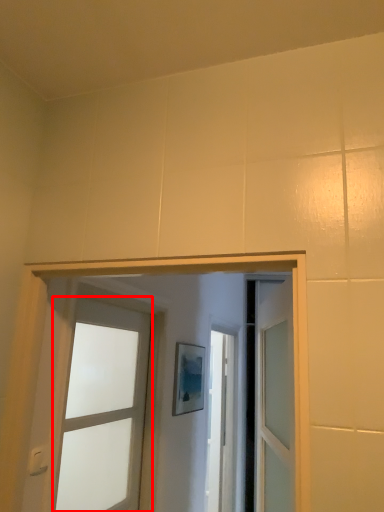
Question: From the image's perspective, where is door (annotated by the red box) located in relation to light switch in the image?

Choices:
 (A) below
 (B) above

Answer: (A)